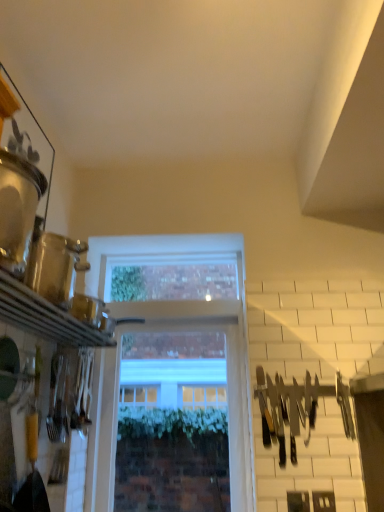
Question: Is clear glass window at center bigger than black plastic knives at right?

Choices:
 (A) no
 (B) yes

Answer: (B)

Question: Is clear glass window at center taller than black plastic knives at right?

Choices:
 (A) no
 (B) yes

Answer: (B)

Question: Considering the relative sizes of clear glass window at center and black plastic knives at right in the image provided, is clear glass window at center smaller than black plastic knives at right?

Choices:
 (A) no
 (B) yes

Answer: (A)

Question: Considering the relative positions of clear glass window at center and black plastic knives at right in the image provided, is clear glass window at center to the left of black plastic knives at right from the viewer's perspective?

Choices:
 (A) yes
 (B) no

Answer: (A)

Question: Is black plastic knives at right at the back of clear glass window at center?

Choices:
 (A) yes
 (B) no

Answer: (B)

Question: From a real-world perspective, is clear glass window at center located higher than black plastic knives at right?

Choices:
 (A) yes
 (B) no

Answer: (A)

Question: Does black plastic knives at right turn towards clear glass window at center?

Choices:
 (A) yes
 (B) no

Answer: (B)

Question: Is black plastic knives at right oriented away from clear glass window at center?

Choices:
 (A) yes
 (B) no

Answer: (B)

Question: Is black plastic knives at right wider than clear glass window at center?

Choices:
 (A) yes
 (B) no

Answer: (B)

Question: Does black plastic knives at right have a lesser width compared to clear glass window at center?

Choices:
 (A) yes
 (B) no

Answer: (A)

Question: Can clear glass window at center be found inside black plastic knives at right?

Choices:
 (A) no
 (B) yes

Answer: (A)

Question: From a real-world perspective, is black plastic knives at right under clear glass window at center?

Choices:
 (A) no
 (B) yes

Answer: (B)

Question: From a real-world perspective, is clear glass window at center physically located above or below black plastic knives at right?

Choices:
 (A) below
 (B) above

Answer: (B)